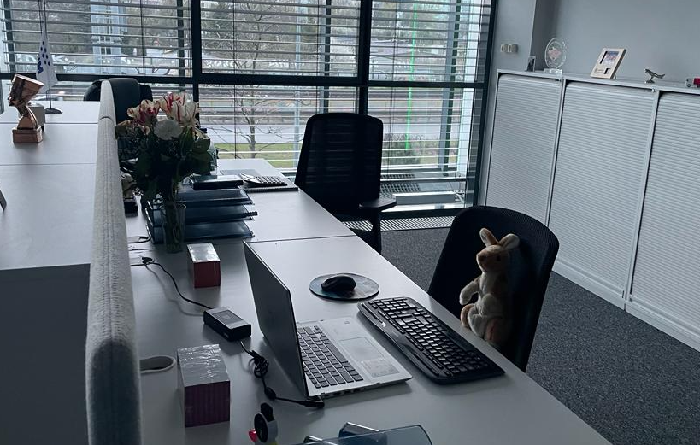
Image resolution: width=700 pixels, height=445 pixels. Find the location of `5 desk`. 5 desk is located at coordinates click(x=334, y=268), click(x=276, y=222), click(x=45, y=222), click(x=52, y=150), click(x=75, y=108).